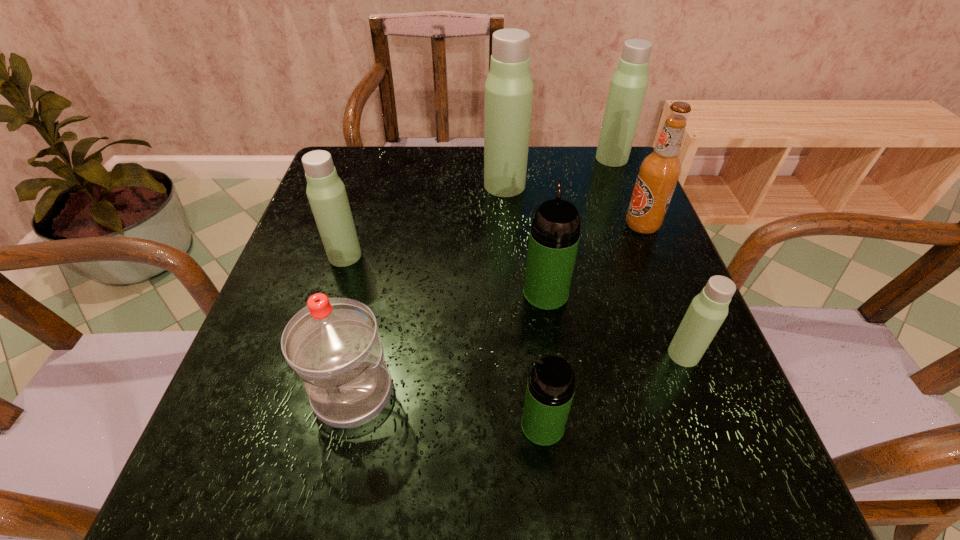
Find the location of a particular element. The width and height of the screenshot is (960, 540). beer bottle at the right edge is located at coordinates (659, 172).

Where is `object at the far right corner`? Image resolution: width=960 pixels, height=540 pixels. object at the far right corner is located at coordinates (628, 86).

Locate an element on the screen. The height and width of the screenshot is (540, 960). free location at the far edge of the desktop is located at coordinates (457, 193).

Find the location of `vacant space at the left edge of the desktop`. vacant space at the left edge of the desktop is located at coordinates (279, 322).

Locate an element on the screen. This screenshot has height=540, width=960. vacant space at the right edge is located at coordinates (645, 327).

The width and height of the screenshot is (960, 540). Find the location of `vacant space at the near left corner`. vacant space at the near left corner is located at coordinates (257, 473).

Find the location of a particular element. This screenshot has height=540, width=960. free space between the third farthest object and the nearer green thermos bottle is located at coordinates (592, 325).

Find the location of `blank region between the tallest thermos bottle and the fifth nearest object`. blank region between the tallest thermos bottle and the fifth nearest object is located at coordinates (424, 220).

The image size is (960, 540). I want to click on free space between the beer bottle and the farthest thermos bottle, so click(x=627, y=192).

The image size is (960, 540). Identify the location of vacant point located between the third farthest object and the third smallest light thermos bottle. (627, 192).